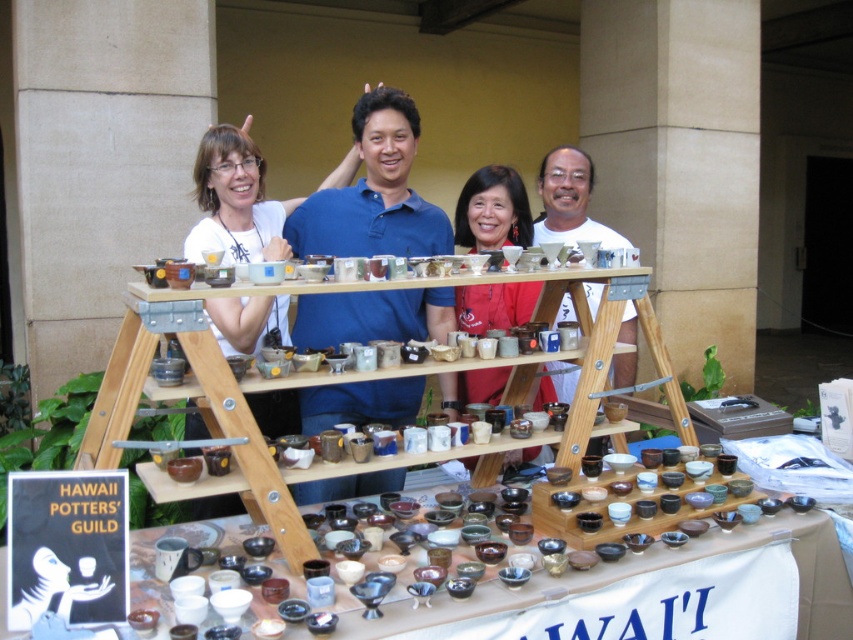
Question: Which of the following is the closest to the observer?

Choices:
 (A) matte ceramic bowls at center
 (B) wooden shelves at center

Answer: (A)

Question: Can you confirm if matte ceramic bowl at center is thinner than matte ceramic bowls at center?

Choices:
 (A) yes
 (B) no

Answer: (A)

Question: Which of these objects is positioned closest to the wooden shelves at center?

Choices:
 (A) matte ceramic bowl at center
 (B) matte ceramic bowls at center

Answer: (B)

Question: Can you confirm if matte ceramic bowl at center is bigger than matte ceramic bowls at center?

Choices:
 (A) no
 (B) yes

Answer: (A)

Question: Is matte ceramic bowl at center below matte ceramic bowls at center?

Choices:
 (A) yes
 (B) no

Answer: (B)

Question: Which object appears farthest from the camera in this image?

Choices:
 (A) wooden shelves at center
 (B) matte ceramic bowls at center

Answer: (A)